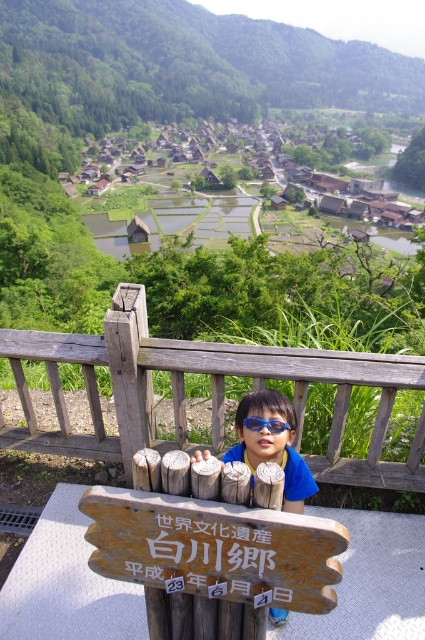
Does wooden sign at center appear on the left side of blue plastic sunglasses at center?

Yes, wooden sign at center is to the left of blue plastic sunglasses at center.

Is point (161, 580) positioned behind point (289, 416)?

No.

Which is behind, point (138, 502) or point (238, 404)?

Positioned behind is point (238, 404).

The width and height of the screenshot is (425, 640). Identify the location of wooden sign at center. (215, 548).

Between weathered wood at center and wooden sign at center, which one appears on the left side from the viewer's perspective?

weathered wood at center

Is point (14, 433) positioned behind point (223, 576)?

Yes, it is behind point (223, 576).

Is point (401, 364) closer to camera compared to point (311, 540)?

That is False.

Where is `weathered wood at center`? weathered wood at center is located at coordinates (212, 392).

What do you see at coordinates (272, 445) in the screenshot?
I see `blue plastic sunglasses at center` at bounding box center [272, 445].

Can you confirm if blue plastic sunglasses at center is positioned to the right of blue plastic goggles at center?

Correct, you'll find blue plastic sunglasses at center to the right of blue plastic goggles at center.

Who is more forward, [288,497] or [272,429]?

Point [272,429] is in front.

Where is `blue plastic sunglasses at center`? Image resolution: width=425 pixels, height=640 pixels. blue plastic sunglasses at center is located at coordinates (272, 445).